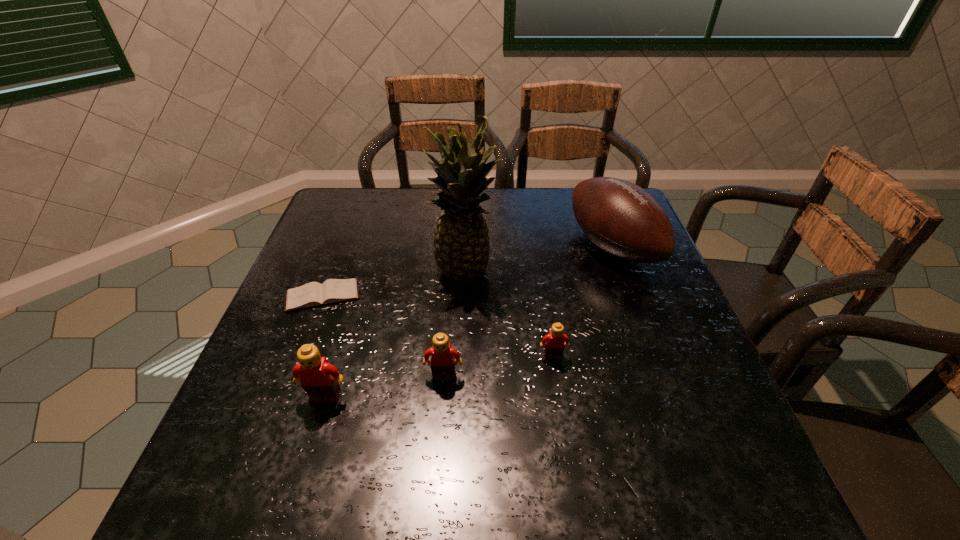
The height and width of the screenshot is (540, 960). Find the location of `free spot between the second nearest object and the shortest Lego`. free spot between the second nearest object and the shortest Lego is located at coordinates (498, 366).

Where is `vacant area between the second object from right to left and the shortest object`? vacant area between the second object from right to left and the shortest object is located at coordinates (438, 326).

The width and height of the screenshot is (960, 540). I want to click on unoccupied area between the diary and the fourth farthest object, so click(438, 326).

You are a GUI agent. You are given a task and a screenshot of the screen. Output one action in this format:
    pyautogui.click(x=<x>, y=<y>)
    Task: Click on the empty space between the pineapple and the third nearest object
    This screenshot has height=540, width=960.
    Given the screenshot: What is the action you would take?
    pyautogui.click(x=509, y=314)

At what (x,y) coordinates should I click in order to perform the action: click on free space between the pineapple and the third shortest object. Please return your answer as a coordinate pair (x, y). Looking at the image, I should click on (454, 324).

Find the location of a particular element. unoccupied area between the rightmost object and the second shortest Lego is located at coordinates (528, 312).

I want to click on vacant space in between the leftmost Lego and the shortest object, so click(x=324, y=347).

Locate an element on the screen. object identified as the third closest to the shortest object is located at coordinates (442, 354).

Find the location of a particular element. object that is the fifth closest to the fourth shortest object is located at coordinates (622, 219).

The image size is (960, 540). Find the location of `Lego that stands as the closest to the pineapple`. Lego that stands as the closest to the pineapple is located at coordinates (553, 343).